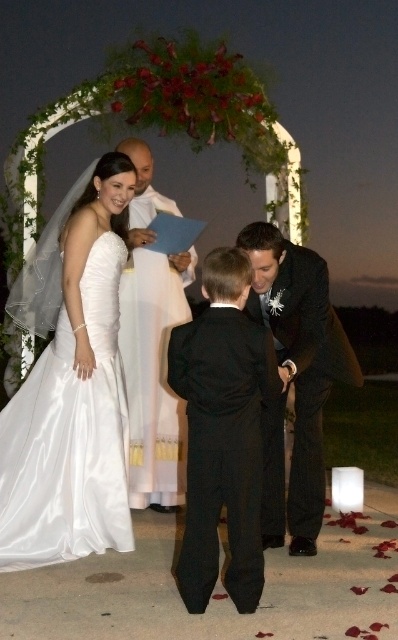
You are a photographer positioned behind the couple at the wedding. You want to capture a closeup shot of the shiny black suit at center and the white satin robe at center. Which one will appear larger in the photo?

The shiny black suit at center will appear larger in the photo because it is closer to the viewer than the white satin robe at center.

You are a photographer at the wedding and want to capture a closeup shot of the satin dress at center and the white satin robe at center. Which one should you focus on to ensure it appears clearer in the photo?

The satin dress at center is closer to the viewer than the white satin robe at center, so focusing on the satin dress at center will ensure it appears clearer in the photo.